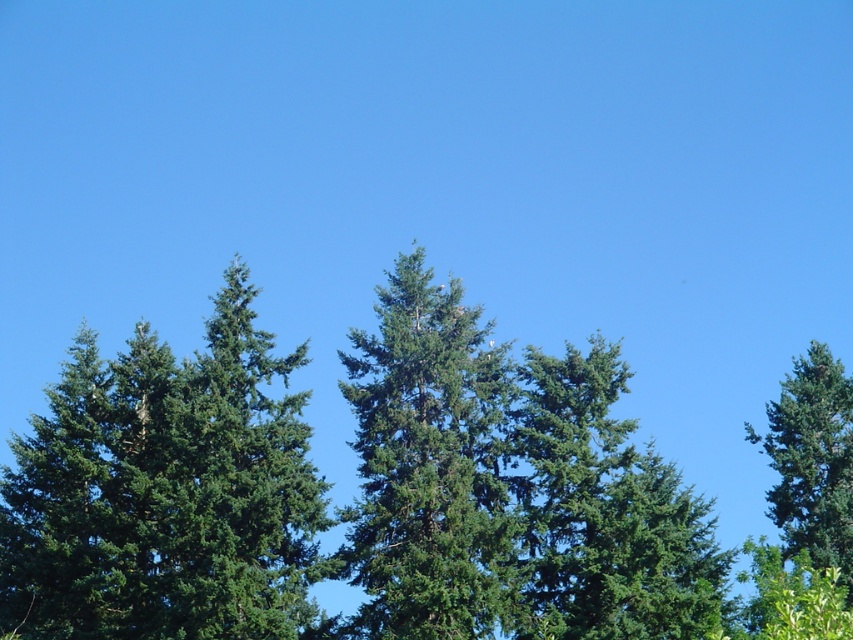
You are planning to plant a new tree in your backyard. You have two options based on the image provided. The green matte tree at center and the green textured tree at right. Which tree has a narrower width and would require less space?

The green matte tree at center has a lesser width compared to the green textured tree at right, so it would require less space.